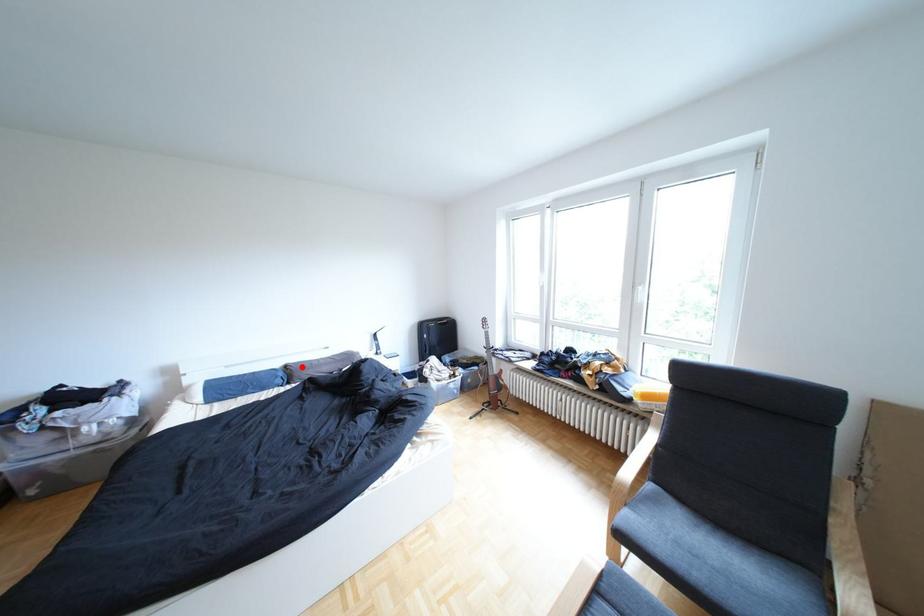
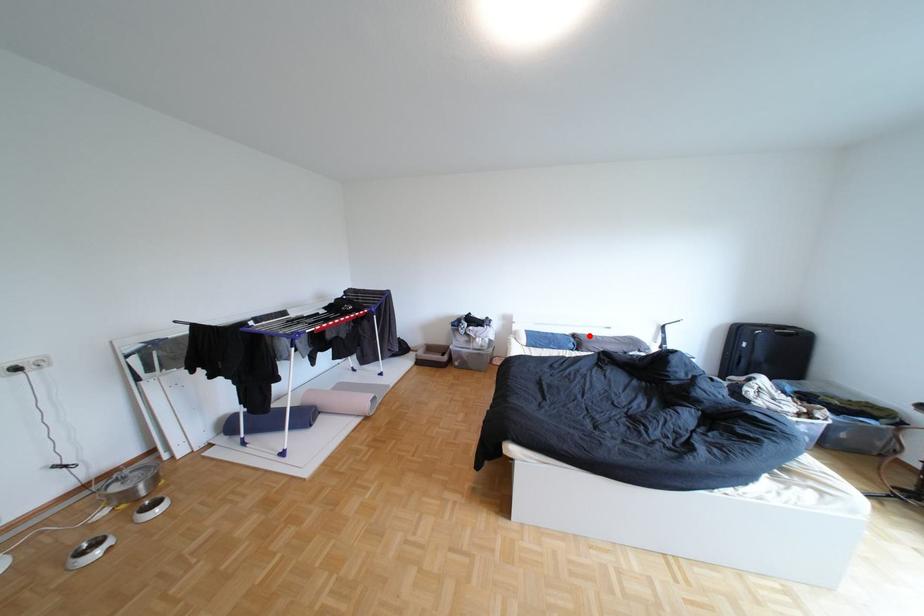
I am providing you with two images of the same scene from different viewpoints. A red point is marked on the first image and another point is marked on the second image. Is the red point in image1 aligned with the point shown in image2?

Yes